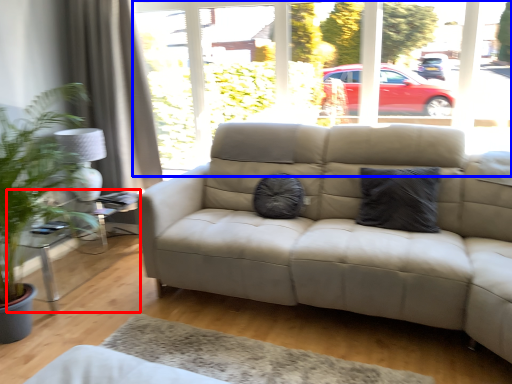
Question: Which object appears farthest to the camera in this image, table (highlighted by a red box) or window frame (highlighted by a blue box)?

Choices:
 (A) table
 (B) window frame

Answer: (A)